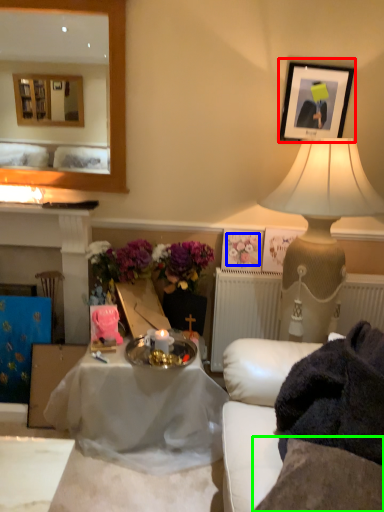
Question: Which object is the farthest from picture frame (highlighted by a red box)? Choose among these: flower (highlighted by a blue box) or sheet (highlighted by a green box).

Choices:
 (A) flower
 (B) sheet

Answer: (B)